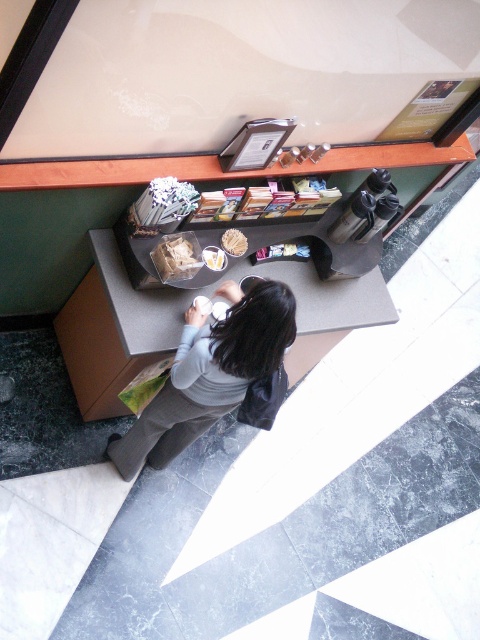
Which is below, dark gray sweater at center or white paper napkin at center?

dark gray sweater at center is lower down.

Is point (284, 307) closer to viewer compared to point (226, 243)?

Yes, point (284, 307) is in front of point (226, 243).

Image resolution: width=480 pixels, height=640 pixels. What are the coordinates of `dark gray sweater at center` in the screenshot? It's located at (210, 372).

Which is behind, point (229, 252) or point (211, 266)?

The point (229, 252) is behind.

Which is above, white paper napkin at center or white matte paper at center?

Positioned higher is white paper napkin at center.

The image size is (480, 640). I want to click on white paper napkin at center, so click(233, 243).

Describe the element at coordinates (210, 372) in the screenshot. I see `dark gray sweater at center` at that location.

Can you confirm if dark gray sweater at center is smaller than white matte paper at center?

No.

You are a GUI agent. You are given a task and a screenshot of the screen. Output one action in this format:
    pyautogui.click(x=<x>, y=<y>)
    Task: Click on the dark gray sweater at center
    This screenshot has height=640, width=480.
    Given the screenshot: What is the action you would take?
    pyautogui.click(x=210, y=372)